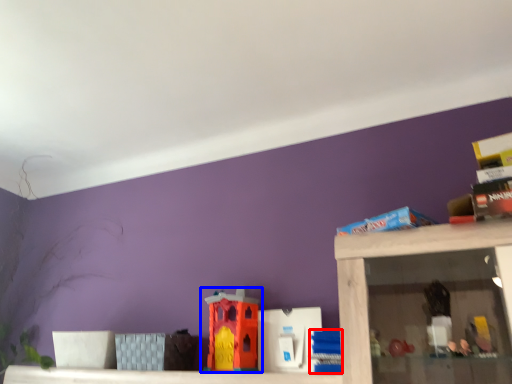
Question: Which point is further to the camera, toy (highlighted by a red box) or toy (highlighted by a blue box)?

Choices:
 (A) toy
 (B) toy

Answer: (B)